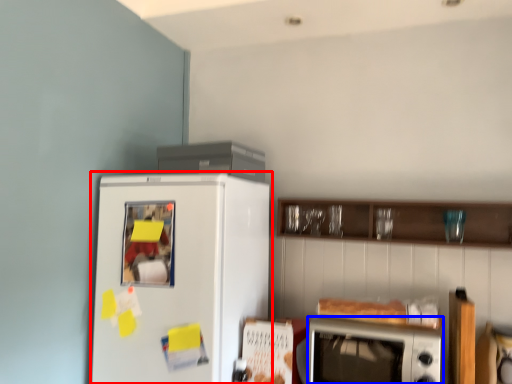
Question: Which point is closer to the camera, refrigerator (highlighted by a red box) or microwave oven (highlighted by a blue box)?

Choices:
 (A) refrigerator
 (B) microwave oven

Answer: (B)